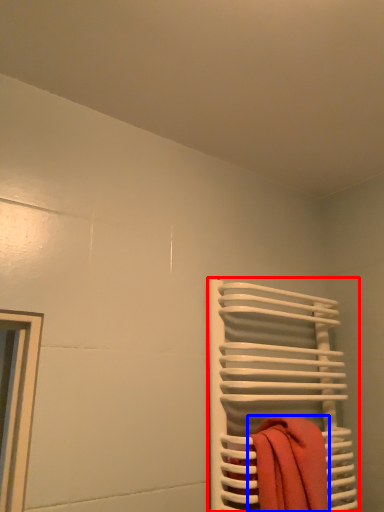
Question: Which of the following is the closest to the observer, towel rack (highlighted by a red box) or beach towel (highlighted by a blue box)?

Choices:
 (A) towel rack
 (B) beach towel

Answer: (B)